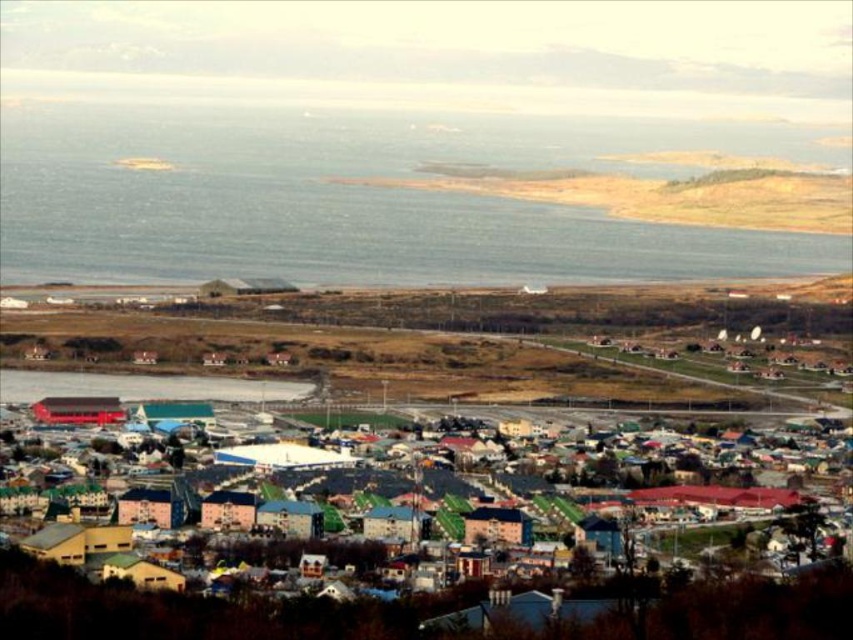
Who is shorter, blue water at center or multicolored wooden houses at center?

multicolored wooden houses at center is shorter.

This screenshot has width=853, height=640. What do you see at coordinates (350, 198) in the screenshot?
I see `blue water at center` at bounding box center [350, 198].

Is point (543, 243) more distant than point (784, 486)?

That is False.

I want to click on blue water at center, so click(x=350, y=198).